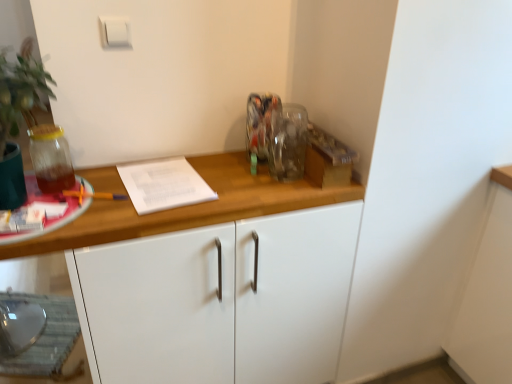
Question: From the image's perspective, does white matte cabinet at center appear higher than translucent glass jar at left?

Choices:
 (A) no
 (B) yes

Answer: (A)

Question: Does white matte cabinet at center have a greater width compared to translucent glass jar at left?

Choices:
 (A) yes
 (B) no

Answer: (A)

Question: Can you confirm if white matte cabinet at center is smaller than translucent glass jar at left?

Choices:
 (A) no
 (B) yes

Answer: (A)

Question: From the image's perspective, is white matte cabinet at center below translucent glass jar at left?

Choices:
 (A) no
 (B) yes

Answer: (B)

Question: Is white matte cabinet at center not within translucent glass jar at left?

Choices:
 (A) yes
 (B) no

Answer: (A)

Question: From the image's perspective, is white plastic light switch at upper center located above or below white matte cabinet at center?

Choices:
 (A) below
 (B) above

Answer: (B)

Question: Is white plastic light switch at upper center wider or thinner than white matte cabinet at center?

Choices:
 (A) thin
 (B) wide

Answer: (A)

Question: Is white plastic light switch at upper center taller or shorter than white matte cabinet at center?

Choices:
 (A) short
 (B) tall

Answer: (A)

Question: Would you say white plastic light switch at upper center is to the left or to the right of white matte cabinet at center in the picture?

Choices:
 (A) right
 (B) left

Answer: (B)

Question: From the image's perspective, is white matte cabinet at center above or below white plastic light switch at upper center?

Choices:
 (A) below
 (B) above

Answer: (A)

Question: Looking at their shapes, would you say white matte cabinet at center is wider or thinner than white plastic light switch at upper center?

Choices:
 (A) thin
 (B) wide

Answer: (B)

Question: From a real-world perspective, is white matte cabinet at center positioned above or below white plastic light switch at upper center?

Choices:
 (A) below
 (B) above

Answer: (A)

Question: Looking at the image, does white matte cabinet at center seem bigger or smaller compared to white plastic light switch at upper center?

Choices:
 (A) big
 (B) small

Answer: (A)

Question: Choose the correct answer: Is white plastic light switch at upper center inside translucent glass jar at left or outside it?

Choices:
 (A) inside
 (B) outside

Answer: (B)

Question: From a real-world perspective, relative to translucent glass jar at left, is white plastic light switch at upper center vertically above or below?

Choices:
 (A) below
 (B) above

Answer: (B)